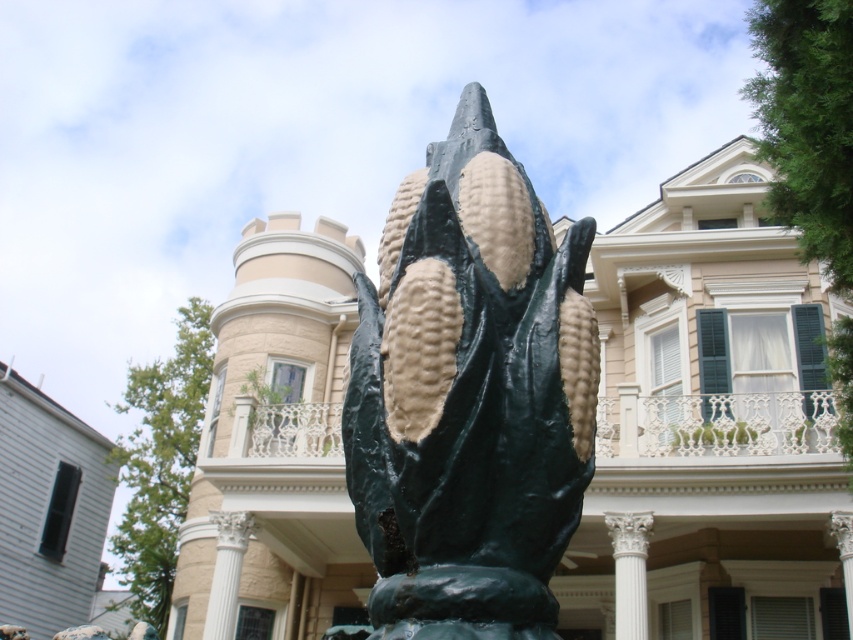
Is green matte corn at center positioned at the back of white marble column at center?

That is False.

Measure the distance between green matte corn at center and white marble column at center.

green matte corn at center and white marble column at center are 36.46 meters apart.

Between point (445, 563) and point (633, 592), which one is positioned in front?

Positioned in front is point (445, 563).

You are a GUI agent. You are given a task and a screenshot of the screen. Output one action in this format:
    pyautogui.click(x=<x>, y=<y>)
    Task: Click on the green matte corn at center
    Image resolution: width=853 pixels, height=640 pixels.
    Given the screenshot: What is the action you would take?
    pyautogui.click(x=469, y=396)

Can you confirm if white marble column at center is shorter than white glossy column at center?

In fact, white marble column at center may be taller than white glossy column at center.

Between white marble column at center and white glossy column at center, which one appears on the left side from the viewer's perspective?

Positioned to the left is white glossy column at center.

Find the location of `white marble column at center`. white marble column at center is located at coordinates (630, 572).

Can you confirm if green matte corn at center is smaller than white glossy column at center?

Actually, green matte corn at center might be larger than white glossy column at center.

Does point (422, 508) come farther from viewer compared to point (241, 540)?

No, it is in front of (241, 540).

Where is `green matte corn at center`? This screenshot has width=853, height=640. green matte corn at center is located at coordinates (469, 396).